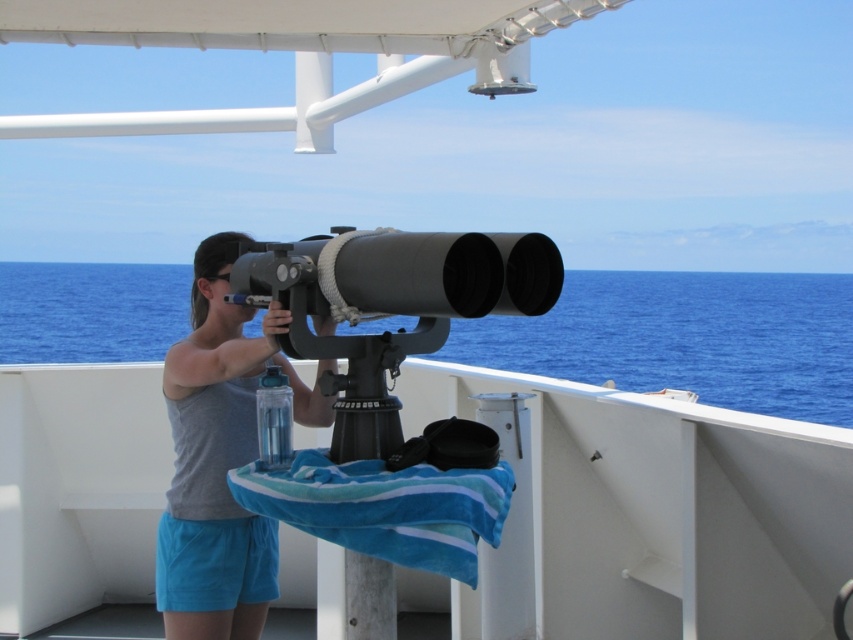
Question: Which point is closer to the camera taking this photo?

Choices:
 (A) (206, 401)
 (B) (339, 275)

Answer: (B)

Question: Observing the image, what is the correct spatial positioning of gray matte tank top at center in reference to matte black telescope at center?

Choices:
 (A) above
 (B) below

Answer: (B)

Question: Does gray matte tank top at center have a greater width compared to matte black telescope at center?

Choices:
 (A) yes
 (B) no

Answer: (B)

Question: Which point appears farthest from the camera in this image?

Choices:
 (A) (241, 604)
 (B) (465, 282)

Answer: (A)

Question: From the image, what is the correct spatial relationship of gray matte tank top at center in relation to matte black telescope at center?

Choices:
 (A) left
 (B) right

Answer: (A)